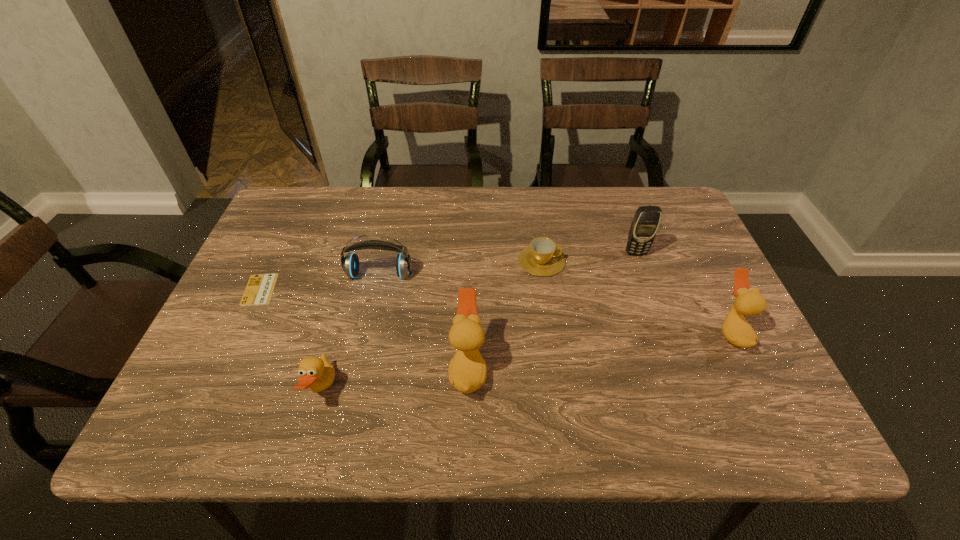
Choose which object is the third nearest neighbor to the fifth object from left to right. Please provide its 2D coordinates. Your answer should be formatted as a tuple, i.e. [(x, y)], where the tuple contains the x and y coordinates of a point satisfying the conditions above.

[(350, 264)]

You are a GUI agent. You are given a task and a screenshot of the screen. Output one action in this format:
    pyautogui.click(x=<x>, y=<y>)
    Task: Click on the object that ranks as the third closest to the identity card
    The height and width of the screenshot is (540, 960).
    Given the screenshot: What is the action you would take?
    pyautogui.click(x=467, y=371)

The width and height of the screenshot is (960, 540). Identify the location of duck that can be found as the third closest to the cellular telephone. (316, 373).

At what (x,y) coordinates should I click in order to perform the action: click on duck identified as the second closest to the sixth tallest object. Please return your answer as a coordinate pair (x, y). Looking at the image, I should click on (749, 302).

Identify the location of vacant area in the image that satisfies the following two spatial constraints: 1. on the front face of the cellular telephone; 2. with the handle on the side of the fifth object from left to right. (638, 261).

At what (x,y) coordinates should I click in order to perform the action: click on vacant space that satisfies the following two spatial constraints: 1. on the ear cups of the headset; 2. on the beak of the shortest duck. Please return your answer as a coordinate pair (x, y). The height and width of the screenshot is (540, 960). Looking at the image, I should click on (354, 389).